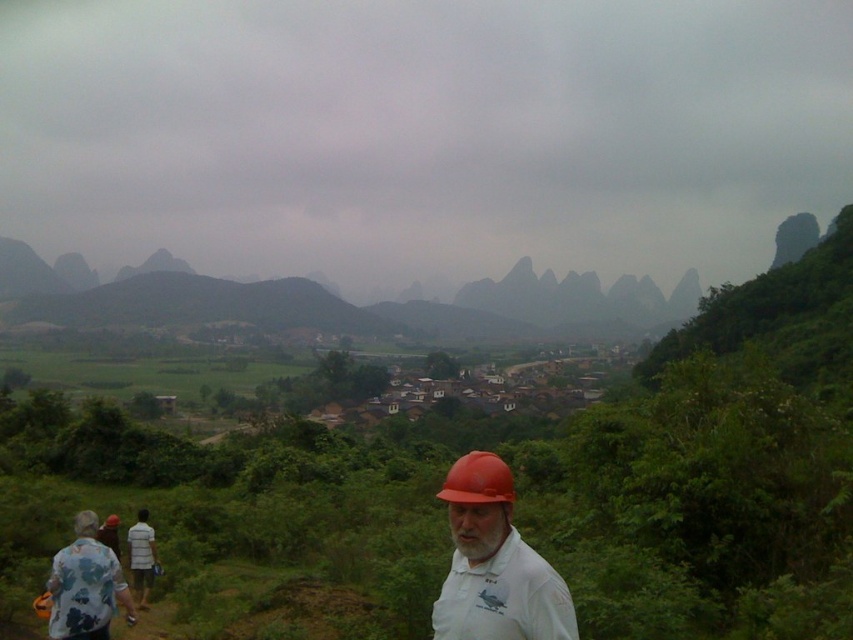
Looking at this image, you are a safety inspector checking the visibility of workers in this rural landscape. The matte orange hard hat at lower center and the white cotton shirt at lower left are both part of the worker attire. Which item has a greater width?

The matte orange hard hat at lower center has a greater width than the white cotton shirt at lower left according to the description.

Based on the photo, you are a drone operator tasked with capturing aerial footage of the village in the midground. You have two points marked on your screen, point (473, 634) and point (146, 515). Which point should you prioritize to ensure the village is clearly visible in your footage?

Point (473, 634) is closer to the camera than point (146, 515). Therefore, prioritizing point (473, 634) will ensure the village is more clearly visible in the footage since it is nearer to the camera.

Based on the photo, you are standing at the point with coordinates point (x=113, y=314) and want to walk to the point (x=479, y=568). According to the image, will you have to walk towards or away from the village in the midground?

Point (x=113, y=314) is behind point (x=479, y=568), so you will have to walk towards the village in the midground.